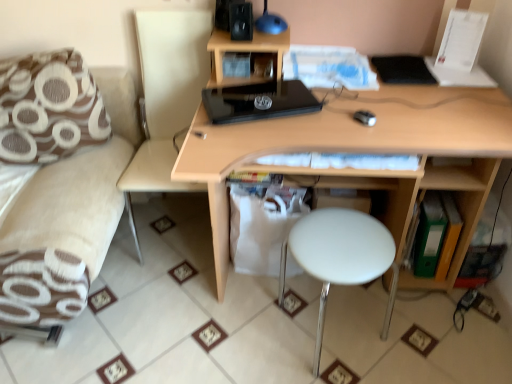
Locate an element on the screen. vacant space in beige fabric swivel chair at left (from a real-world perspective) is located at coordinates (182, 230).